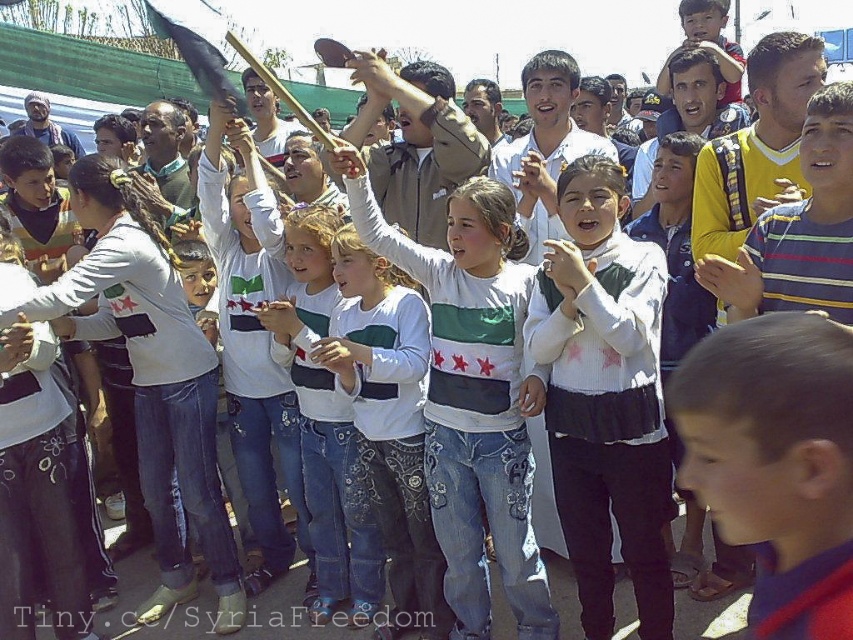
You are a photographer trying to capture a closeup of the blue denim jeans at center and the white denim jeans at center. Given their sizes, which pair of jeans would you need to position closer to the camera to ensure both appear equally large in the photo?

The blue denim jeans at center occupies less space than white denim jeans at center, so you would need to position the blue denim jeans at center closer to the camera to make them appear the same size as the white denim jeans at center in the photo.

You are standing at the point labeled as point (610, 346) in the image. If you want to take a photo of the entire scene, would you need to zoom in or out to include everything in the frame?

Since the point (610, 346) is 7.39 meters away from the camera, you would need to zoom out to capture the entire scene in the frame.